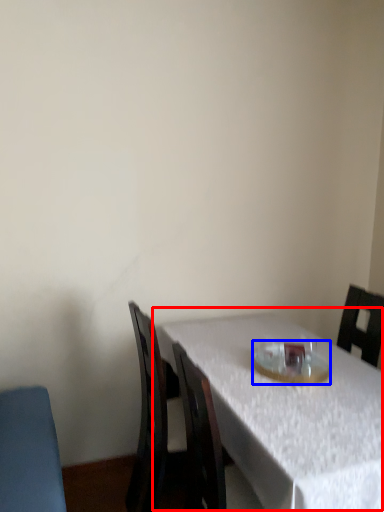
Question: Which object is closer to the camera taking this photo, table (highlighted by a red box) or tableware (highlighted by a blue box)?

Choices:
 (A) table
 (B) tableware

Answer: (A)